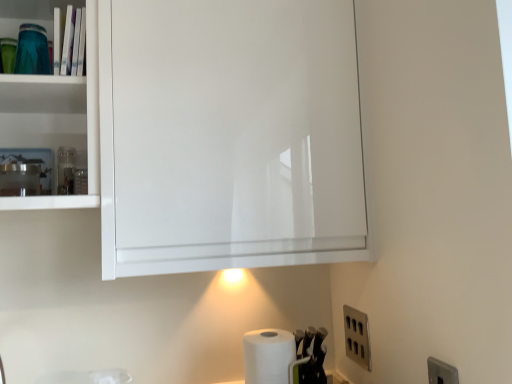
Image resolution: width=512 pixels, height=384 pixels. What do you see at coordinates (357, 337) in the screenshot?
I see `satin nickel outlet at lower right` at bounding box center [357, 337].

What is the approximate width of satin nickel outlet at lower right?

It is 1.05 inches.

The image size is (512, 384). Identify the location of satin nickel outlet at lower right. (357, 337).

The width and height of the screenshot is (512, 384). Describe the element at coordinates (269, 356) in the screenshot. I see `white matte paper towel at lower center` at that location.

Identify the location of white matte paper towel at lower center. The image size is (512, 384). (269, 356).

This screenshot has height=384, width=512. I want to click on satin nickel outlet at lower right, so click(x=357, y=337).

Between white matte paper towel at lower center and satin nickel outlet at lower right, which one appears on the left side from the viewer's perspective?

Positioned to the left is white matte paper towel at lower center.

Which is in front, white matte paper towel at lower center or satin nickel outlet at lower right?

white matte paper towel at lower center.

Which point is more distant from viewer, (264, 357) or (348, 326)?

The point (348, 326) is farther.

From the image's perspective, does white matte paper towel at lower center appear lower than satin nickel outlet at lower right?

Yes.

From a real-world perspective, is white matte paper towel at lower center positioned above or below satin nickel outlet at lower right?

From a real-world perspective, white matte paper towel at lower center is physically below satin nickel outlet at lower right.

Which of these two, white matte paper towel at lower center or satin nickel outlet at lower right, is wider?

white matte paper towel at lower center is wider.

Between white matte paper towel at lower center and satin nickel outlet at lower right, which one has less height?

Standing shorter between the two is satin nickel outlet at lower right.

Between white matte paper towel at lower center and satin nickel outlet at lower right, which one has larger size?

Bigger between the two is white matte paper towel at lower center.

Would you say white matte paper towel at lower center contains satin nickel outlet at lower right?

No, white matte paper towel at lower center does not contain satin nickel outlet at lower right.

Is white matte paper towel at lower center touching satin nickel outlet at lower right?

There is a gap between white matte paper towel at lower center and satin nickel outlet at lower right.

Is satin nickel outlet at lower right at the back of white matte paper towel at lower center?

No, white matte paper towel at lower center is not facing away from satin nickel outlet at lower right.

How different are the orientations of white matte paper towel at lower center and satin nickel outlet at lower right in degrees?

white matte paper towel at lower center and satin nickel outlet at lower right are facing 83.1 degrees away from each other.

How much distance is there between white matte paper towel at lower center and satin nickel outlet at lower right?

white matte paper towel at lower center is 9.00 inches from satin nickel outlet at lower right.

I want to click on electric outlet above the white matte paper towel at lower center (from the image's perspective), so click(x=357, y=337).

Which is more to the right, satin nickel outlet at lower right or white matte paper towel at lower center?

From the viewer's perspective, satin nickel outlet at lower right appears more on the right side.

Between satin nickel outlet at lower right and white matte paper towel at lower center, which one is positioned in front?

white matte paper towel at lower center is more forward.

Which is nearer, (347,306) or (272,361)?

The point (272,361) is closer.

From the image's perspective, is satin nickel outlet at lower right on top of white matte paper towel at lower center?

Yes, from the image's perspective, satin nickel outlet at lower right is above white matte paper towel at lower center.

From a real-world perspective, which is physically above, satin nickel outlet at lower right or white matte paper towel at lower center?

satin nickel outlet at lower right is physically above.

Considering the relative sizes of satin nickel outlet at lower right and white matte paper towel at lower center in the image provided, is satin nickel outlet at lower right wider than white matte paper towel at lower center?

Incorrect, the width of satin nickel outlet at lower right does not surpass that of white matte paper towel at lower center.

Is satin nickel outlet at lower right shorter than white matte paper towel at lower center?

Correct, satin nickel outlet at lower right is not as tall as white matte paper towel at lower center.

Is satin nickel outlet at lower right bigger or smaller than white matte paper towel at lower center?

satin nickel outlet at lower right is smaller than white matte paper towel at lower center.

Is satin nickel outlet at lower right inside or outside of white matte paper towel at lower center?

satin nickel outlet at lower right lies outside white matte paper towel at lower center.

Are satin nickel outlet at lower right and white matte paper towel at lower center located far from each other?

satin nickel outlet at lower right is near white matte paper towel at lower center, not far away.

Does satin nickel outlet at lower right turn towards white matte paper towel at lower center?

Yes.

This screenshot has width=512, height=384. In order to click on electric outlet above the white matte paper towel at lower center (from the image's perspective) in this screenshot , I will do `click(357, 337)`.

This screenshot has width=512, height=384. I want to click on paper towel that is on the left side of satin nickel outlet at lower right, so click(x=269, y=356).

The image size is (512, 384). Find the location of `paper towel below the satin nickel outlet at lower right (from a real-world perspective)`. paper towel below the satin nickel outlet at lower right (from a real-world perspective) is located at coordinates (269, 356).